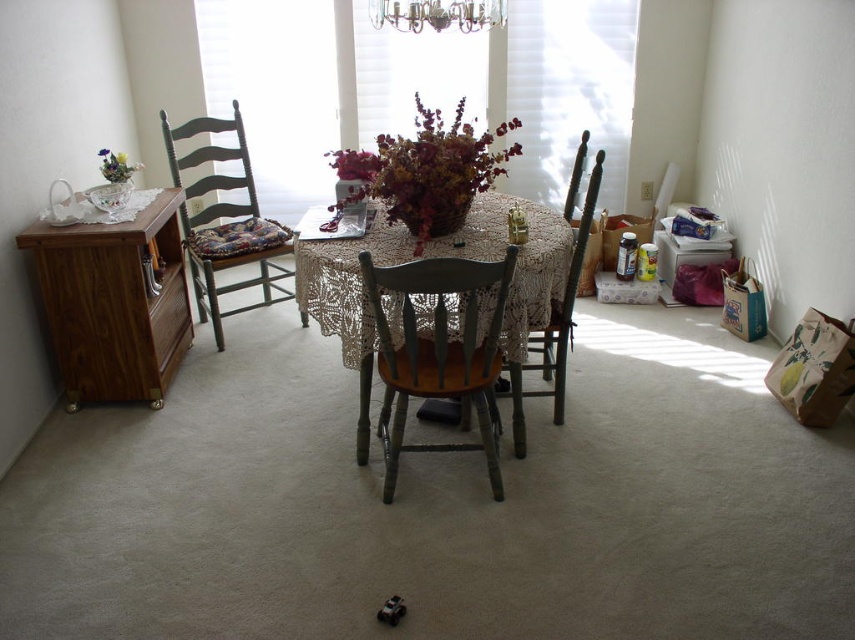
Question: Is brown wood cabinet at left smaller than wooden chair at center?

Choices:
 (A) no
 (B) yes

Answer: (B)

Question: Which point appears closest to the camera in this image?

Choices:
 (A) (573, 292)
 (B) (553, 296)
 (C) (116, 259)

Answer: (B)

Question: Which object appears farthest from the camera in this image?

Choices:
 (A) translucent glass window at center
 (B) metallic chandelier at upper center

Answer: (A)

Question: Is the position of translucent glass window at center more distant than that of dark brown wood chair at center?

Choices:
 (A) yes
 (B) no

Answer: (A)

Question: Is lace fabric tablecloth at center positioned behind matte floral arrangement at left?

Choices:
 (A) no
 (B) yes

Answer: (A)

Question: Based on their relative distances, which object is nearer to the brown wood cabinet at left?

Choices:
 (A) matte floral arrangement at left
 (B) metallic chandelier at upper center

Answer: (A)